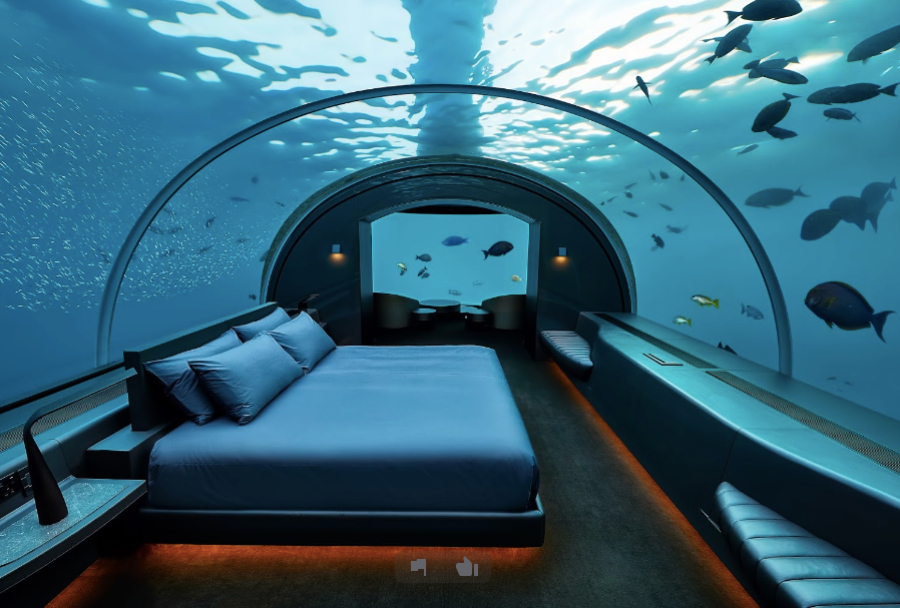
Locate an element on the screen. base of bed is located at coordinates (524, 528).